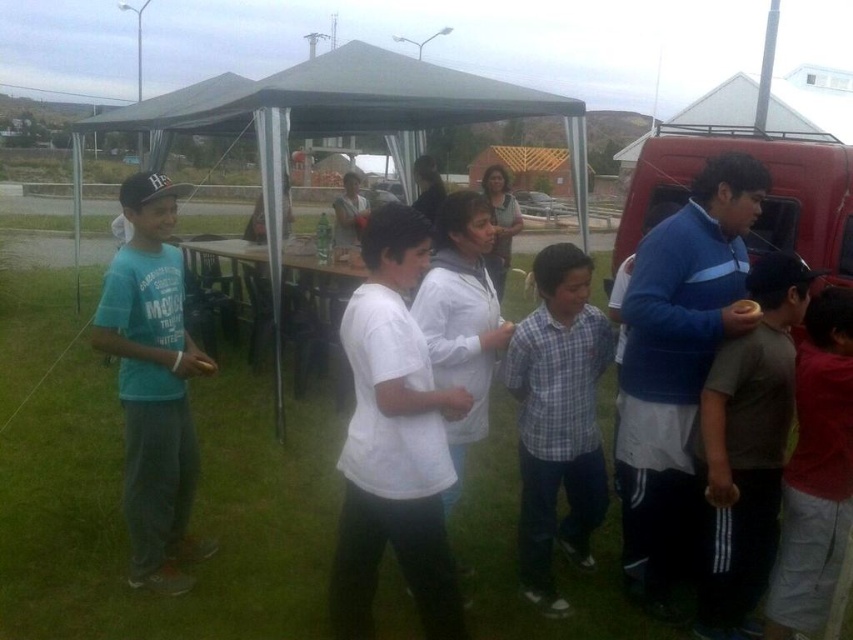
Is the position of green fabric tent at center less distant than that of red shirt at center?

No, it is not.

Is green fabric tent at center above red shirt at center?

Yes.

Locate an element on the screen. Image resolution: width=853 pixels, height=640 pixels. green fabric tent at center is located at coordinates (338, 120).

Which of these two, brown cotton shirt at right or plaid cotton shirt at center, stands taller?

plaid cotton shirt at center is taller.

The height and width of the screenshot is (640, 853). Describe the element at coordinates (747, 448) in the screenshot. I see `brown cotton shirt at right` at that location.

At what (x,y) coordinates should I click in order to perform the action: click on brown cotton shirt at right. Please return your answer as a coordinate pair (x, y). The image size is (853, 640). Looking at the image, I should click on coord(747,448).

How distant is teal t-shirt at left from red shirt at center?

teal t-shirt at left and red shirt at center are 8.11 feet apart.

Consider the image. Between teal t-shirt at left and red shirt at center, which one appears on the left side from the viewer's perspective?

From the viewer's perspective, teal t-shirt at left appears more on the left side.

Who is more forward, (161, 566) or (828, 292)?

Point (828, 292)

Where is `teal t-shirt at left`? Image resolution: width=853 pixels, height=640 pixels. teal t-shirt at left is located at coordinates (154, 385).